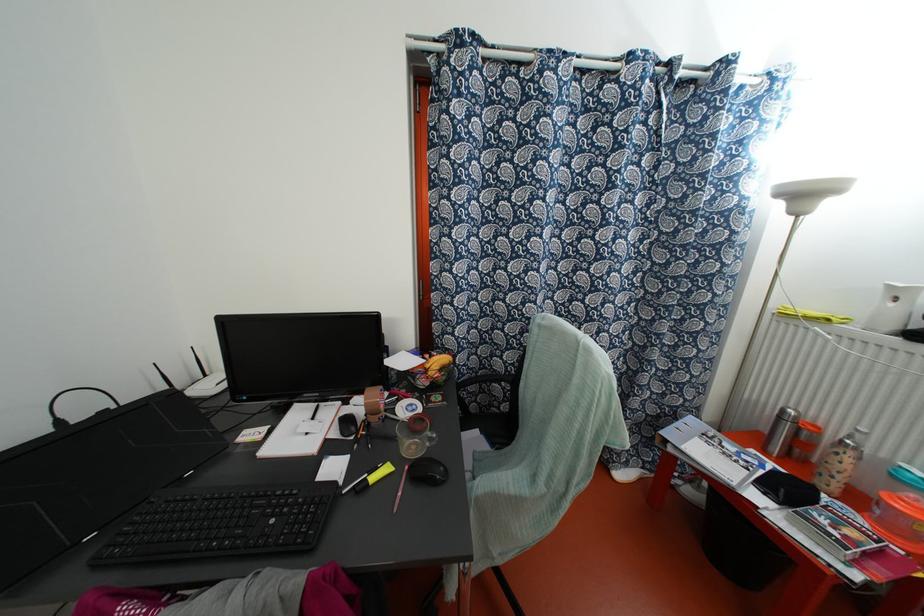
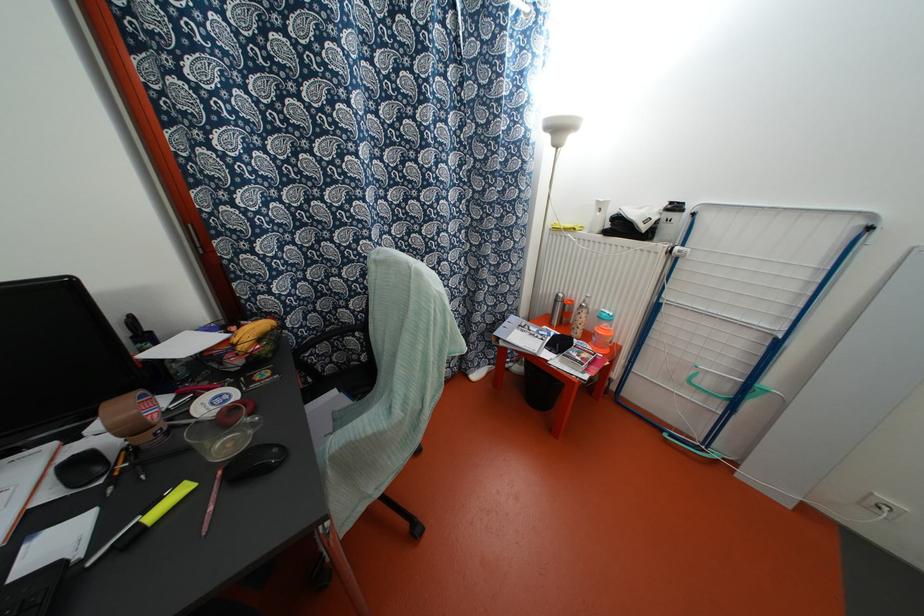
Locate, in the second image, the point that corresponds to point (427, 365) in the first image.

(234, 339)